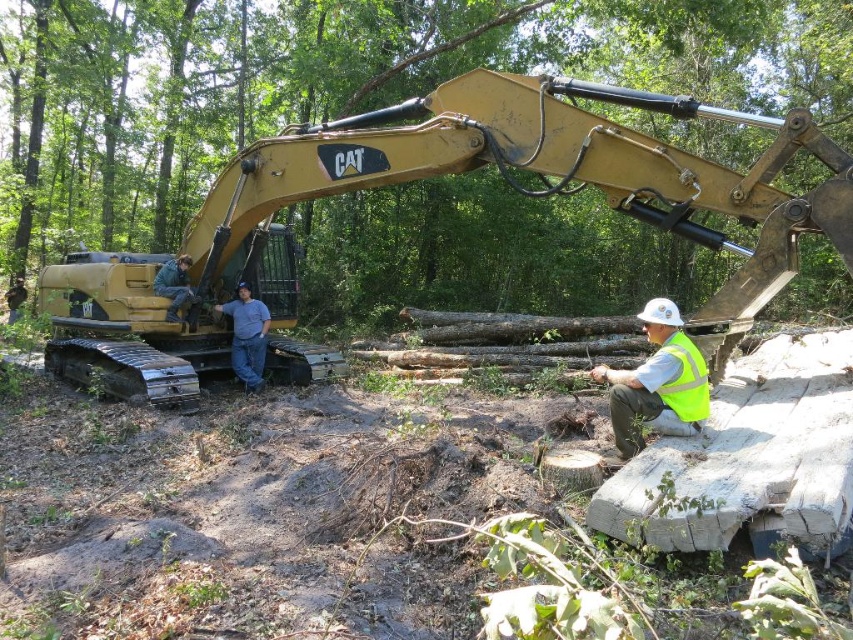
Question: Can you confirm if gold metallic excavator at left is positioned below brushed metal helmet at left?

Choices:
 (A) no
 (B) yes

Answer: (A)

Question: Which object is closer to the camera taking this photo?

Choices:
 (A) denim pants at center
 (B) yellow reflective vest at lower right
 (C) high-visibility fabric safety vest at lower right
 (D) gold metallic excavator at left

Answer: (D)

Question: Can you confirm if denim pants at center is positioned to the right of high-visibility fabric safety vest at lower right?

Choices:
 (A) no
 (B) yes

Answer: (A)

Question: Which object is positioned farthest from the denim pants at center?

Choices:
 (A) brushed metal helmet at left
 (B) high-visibility fabric safety vest at lower right

Answer: (B)

Question: Which object is the farthest from the gold metallic excavator at left?

Choices:
 (A) high-visibility fabric safety vest at lower right
 (B) yellow reflective vest at lower right
 (C) brushed metal helmet at left

Answer: (B)

Question: Does yellow reflective vest at lower right have a smaller size compared to brushed metal helmet at left?

Choices:
 (A) no
 (B) yes

Answer: (A)